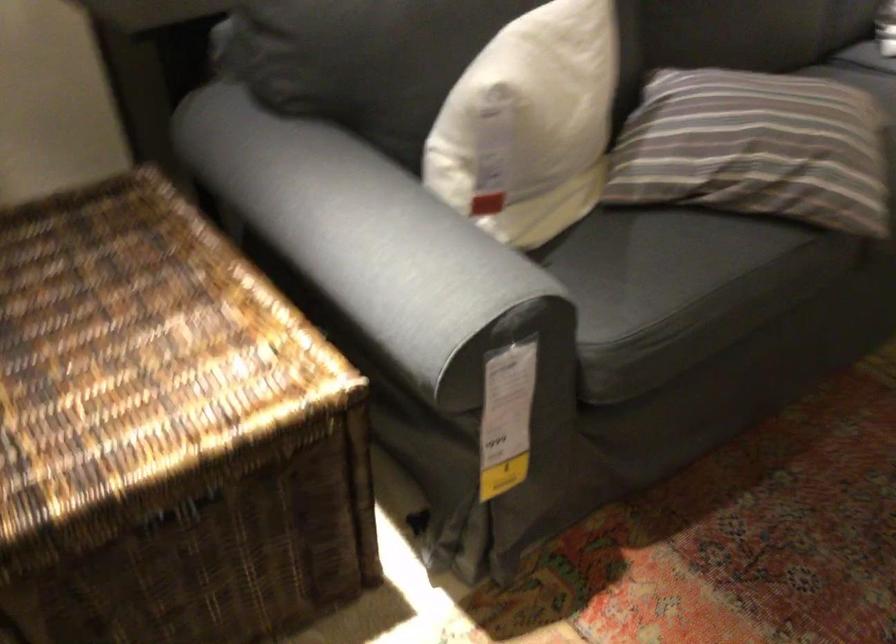
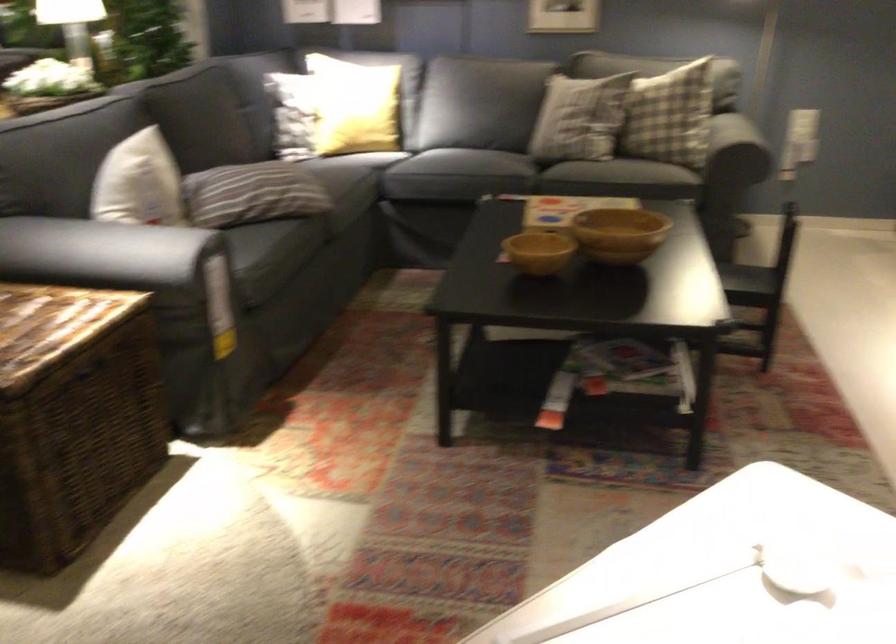
In the second image, find the point that corresponds to pixel 185 370 in the first image.

(55, 317)